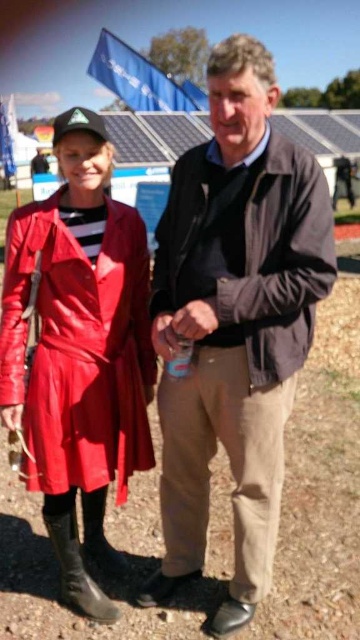
Question: From the image, what is the correct spatial relationship of dirt field at center in relation to black leather boot at lower left?

Choices:
 (A) right
 (B) left

Answer: (B)

Question: Is brown leather jacket at center positioned in front of black leather boot at lower left?

Choices:
 (A) no
 (B) yes

Answer: (B)

Question: Which object is farther from the camera taking this photo?

Choices:
 (A) brown leather jacket at center
 (B) dirt field at center
 (C) black leather boot at lower left
 (D) matte leather coat at left

Answer: (B)

Question: Observing the image, what is the correct spatial positioning of matte leather coat at left in reference to black leather boot at lower left?

Choices:
 (A) left
 (B) right

Answer: (B)

Question: Which point is farther to the camera?

Choices:
 (A) black leather boot at lower left
 (B) dirt field at center

Answer: (B)

Question: Which point appears closest to the camera in this image?

Choices:
 (A) (308, 577)
 (B) (189, 156)
 (C) (74, 547)
 (D) (18, 228)

Answer: (D)